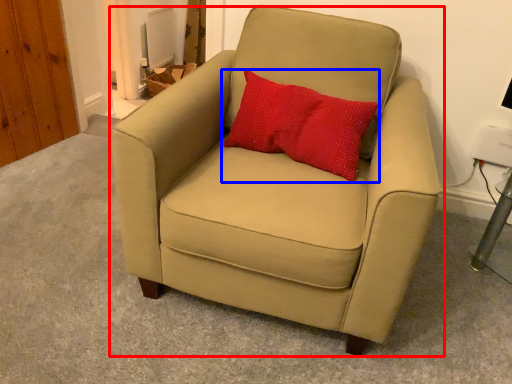
Question: Among these objects, which one is nearest to the camera, chair (highlighted by a red box) or pillow (highlighted by a blue box)?

Choices:
 (A) chair
 (B) pillow

Answer: (A)